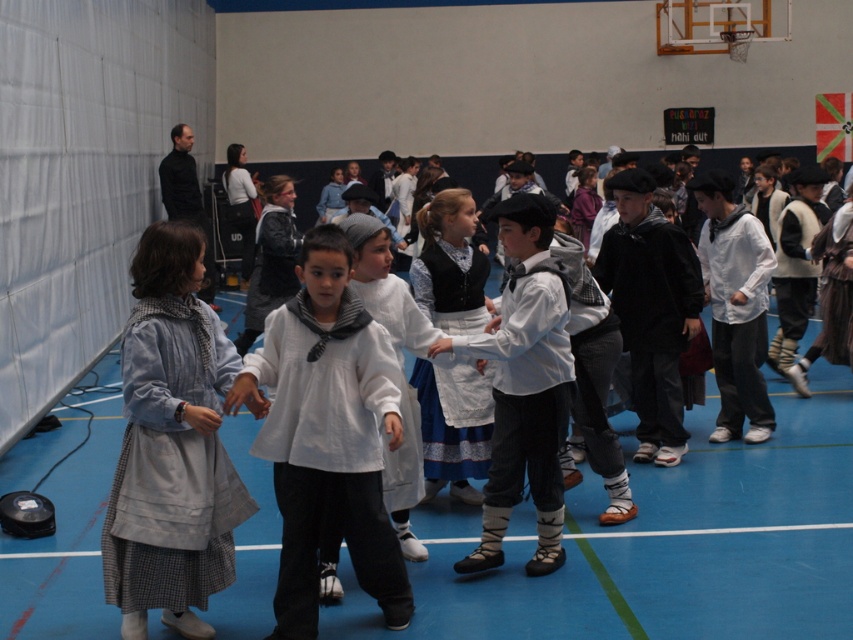
Question: Which point is farther from the camera taking this photo?

Choices:
 (A) (360, 561)
 (B) (161, 403)
 (C) (451, 234)

Answer: (C)

Question: Observing the image, what is the correct spatial positioning of white matte shirt at center in reference to white cotton shirt at center?

Choices:
 (A) right
 (B) left

Answer: (B)

Question: Among these objects, which one is farthest from the camera?

Choices:
 (A) denim jacket at left
 (B) white matte shirt at center
 (C) white cotton shirt at center
 (D) blue and white dress at center

Answer: (D)

Question: Does denim jacket at left appear on the right side of white matte shirt at center?

Choices:
 (A) yes
 (B) no

Answer: (B)

Question: Observing the image, what is the correct spatial positioning of denim jacket at left in reference to white cotton shirt at center?

Choices:
 (A) above
 (B) below

Answer: (B)

Question: Among these objects, which one is nearest to the camera?

Choices:
 (A) blue and white dress at center
 (B) denim jacket at left
 (C) white matte shirt at center
 (D) white cotton shirt at center

Answer: (C)